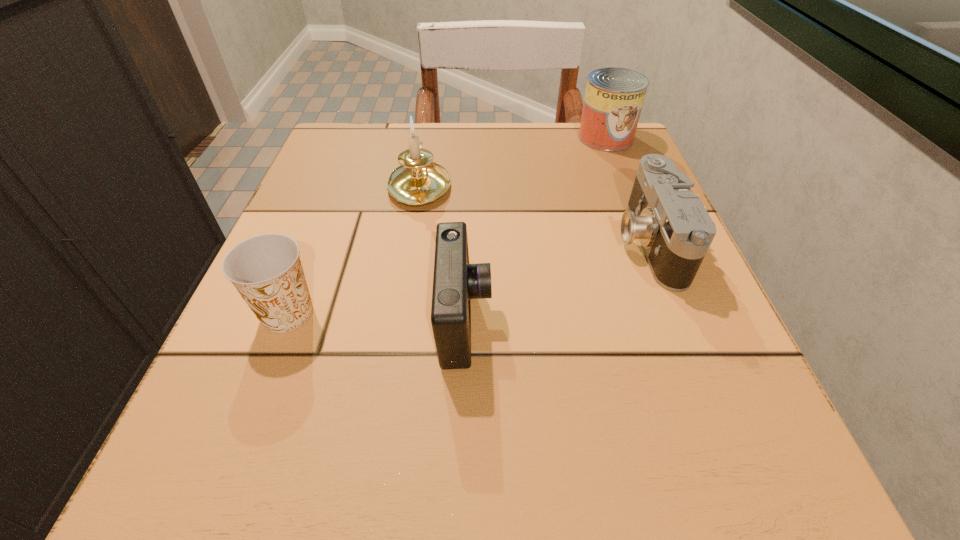
Locate an element on the screen. The width and height of the screenshot is (960, 540). candle holder is located at coordinates (419, 181).

Where is `the farthest object`? Image resolution: width=960 pixels, height=540 pixels. the farthest object is located at coordinates (614, 97).

At what (x,y) coordinates should I click in order to perform the action: click on the left camera. Please return your answer as a coordinate pair (x, y). Looking at the image, I should click on (455, 282).

Where is `the leftmost object`? This screenshot has width=960, height=540. the leftmost object is located at coordinates (266, 270).

Find the location of a particular element. The image size is (960, 540). the right camera is located at coordinates (675, 230).

Identify the location of vacant space located on the handle side of the candle holder. (427, 137).

Image resolution: width=960 pixels, height=540 pixels. What are the coordinates of `free location located on the handle side of the candle holder` in the screenshot? It's located at (429, 130).

Identify the location of free spot located on the left of the can. This screenshot has height=540, width=960. (410, 138).

Locate an element on the screen. The image size is (960, 540). vacant region located on the front-facing side of the left camera is located at coordinates (535, 321).

In order to click on vacant space located 0.240m on the back of the leftmost object in this screenshot , I will do `click(334, 194)`.